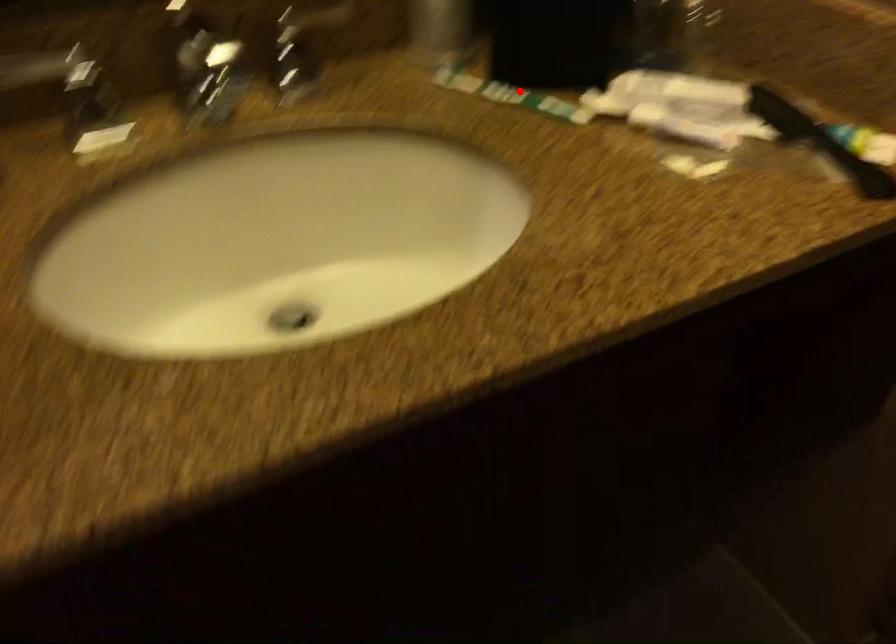
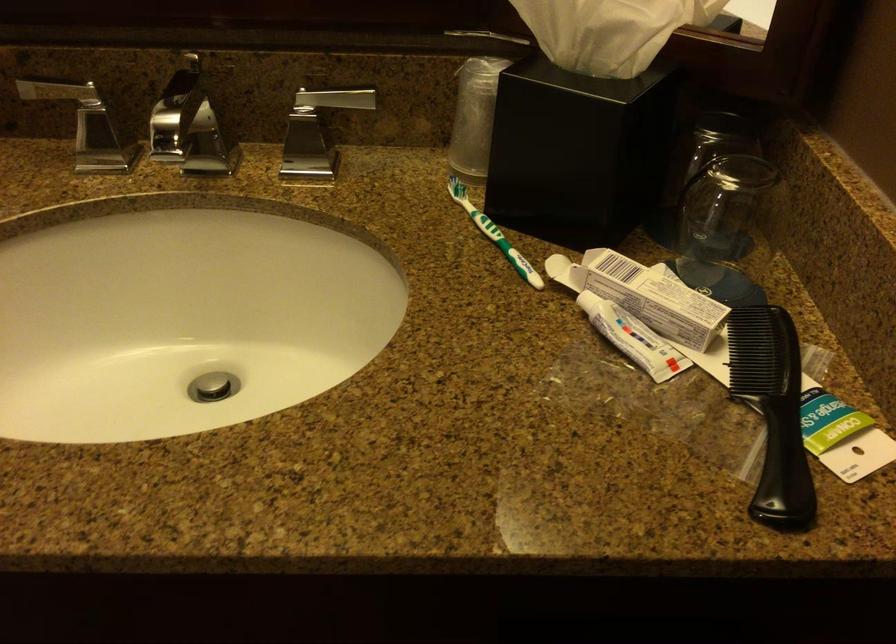
In the second image, find the point that corresponds to the highlighted location in the first image.

(494, 234)